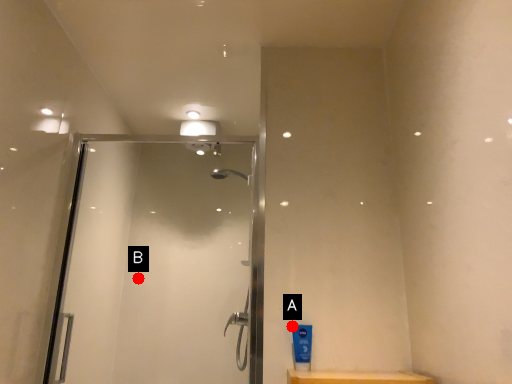
Question: Two points are circled on the image, labeled by A and B beside each circle. Which point is closer to the camera taking this photo?

Choices:
 (A) A is closer
 (B) B is closer

Answer: (A)